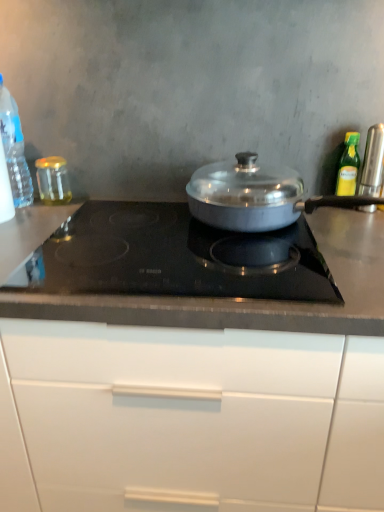
The height and width of the screenshot is (512, 384). I want to click on free spot below satin silver pan at center, the 3th kitchen appliance when ordered from right to left (from a real-world perspective), so click(x=304, y=228).